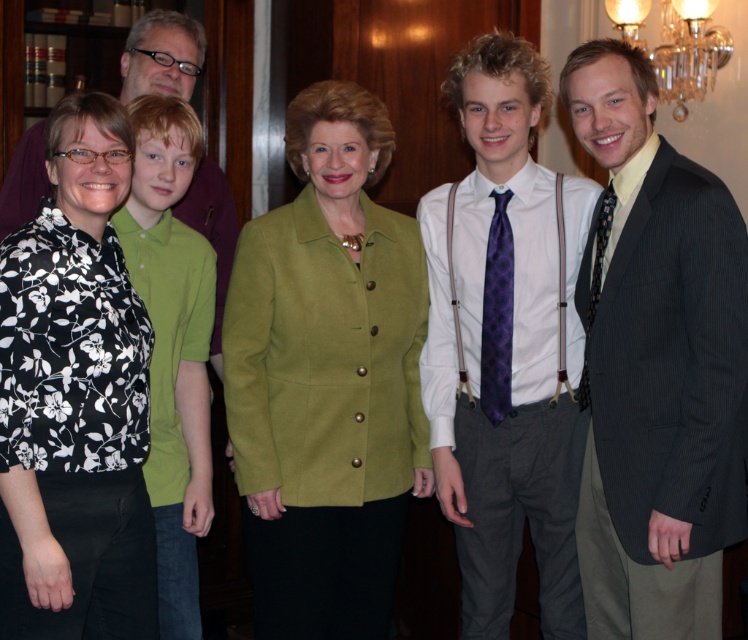
Does point (242, 337) come behind point (485, 456)?

No, it is in front of (485, 456).

Is green suede jacket at center thinner than purple tie at center?

Incorrect, green suede jacket at center's width is not less than purple tie at center's.

Between point (375, 552) and point (432, 280), which one is positioned in front?

Point (375, 552)

Where is `green suede jacket at center`? The width and height of the screenshot is (748, 640). green suede jacket at center is located at coordinates (328, 378).

Which is more to the left, green suede jacket at center or clear crystal chandelier at upper right?

green suede jacket at center

Does point (298, 152) come farther from viewer compared to point (652, 61)?

No.

You are a GUI agent. You are given a task and a screenshot of the screen. Output one action in this format:
    pyautogui.click(x=<x>, y=<y>)
    Task: Click on the green suede jacket at center
    
    Given the screenshot: What is the action you would take?
    pyautogui.click(x=328, y=378)

Is black floral blouse at left taller than purple woven tie at center?

Correct, black floral blouse at left is much taller as purple woven tie at center.

Can you confirm if black floral blouse at left is bigger than purple woven tie at center?

Correct, black floral blouse at left is larger in size than purple woven tie at center.

This screenshot has height=640, width=748. Find the location of `black floral blouse at left`. black floral blouse at left is located at coordinates (73, 397).

You are a GUI agent. You are given a task and a screenshot of the screen. Output one action in this format:
    pyautogui.click(x=<x>, y=<y>)
    Task: Click on the black floral blouse at left
    The image size is (748, 640).
    Given the screenshot: What is the action you would take?
    pyautogui.click(x=73, y=397)